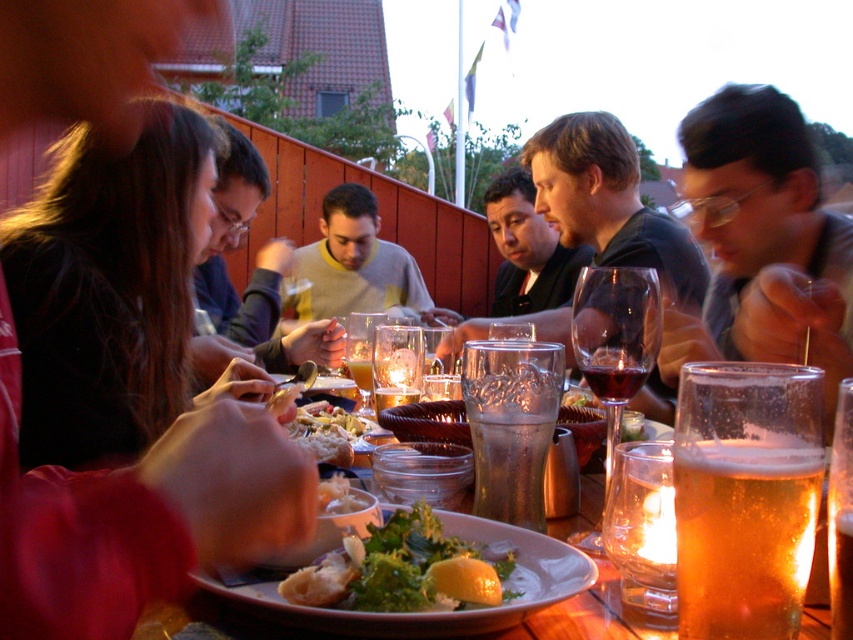
From the picture: Can you confirm if matte black hair at upper right is taller than white creamy pasta at center?

Correct, matte black hair at upper right is much taller as white creamy pasta at center.

Between matte black hair at upper right and white creamy pasta at center, which one has more height?

matte black hair at upper right

Is point (828, 316) positioned after point (323, 428)?

No.

Identify the location of matte black hair at upper right. This screenshot has width=853, height=640. (759, 237).

Can you confirm if matte black hair at upper right is positioned above ruby glass at center?

Yes.

Is matte black hair at upper right in front of ruby glass at center?

No, matte black hair at upper right is further to the viewer.

Where is `matte black hair at upper right`? The image size is (853, 640). matte black hair at upper right is located at coordinates (759, 237).

Where is `matte black hair at upper right`? This screenshot has width=853, height=640. matte black hair at upper right is located at coordinates (759, 237).

Between matte black hair at upper right and translucent glass wine glass at center, which one has less height?

translucent glass wine glass at center

Is matte black hair at upper right closer to the viewer compared to translucent glass wine glass at center?

Yes, matte black hair at upper right is closer to the viewer.

Does point (781, 320) come farther from viewer compared to point (346, 337)?

No, (781, 320) is closer to viewer.

Where is `matte black hair at upper right`? The image size is (853, 640). matte black hair at upper right is located at coordinates (759, 237).